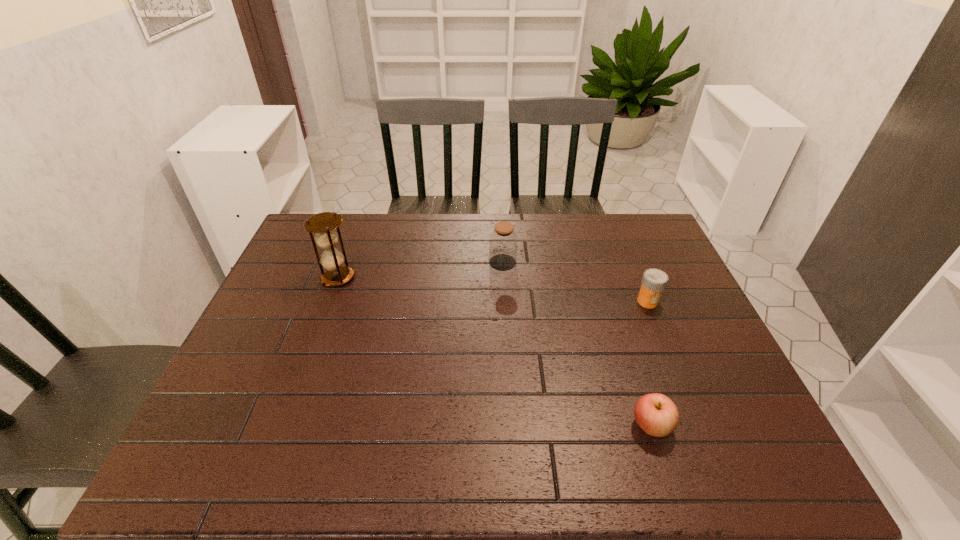
You are a GUI agent. You are given a task and a screenshot of the screen. Output one action in this format:
    pyautogui.click(x=<x>, y=<y>)
    Task: Click on the free point located on the label side of the second nearest object
    
    Given the screenshot: What is the action you would take?
    pyautogui.click(x=667, y=348)

Image resolution: width=960 pixels, height=540 pixels. I want to click on vacant space positioned on the right of the apple, so click(x=704, y=426).

Where is `object that is at the far edge`? object that is at the far edge is located at coordinates (503, 240).

Find the location of a particular element. This screenshot has height=540, width=960. object at the near edge is located at coordinates (656, 414).

Identify the location of object that is at the left edge. The width and height of the screenshot is (960, 540). (323, 224).

I want to click on object that is positioned at the right edge, so click(654, 281).

Image resolution: width=960 pixels, height=540 pixels. I want to click on vacant area at the far edge of the desktop, so click(534, 237).

The image size is (960, 540). I want to click on blank space at the near edge, so tap(517, 450).

Where is `vacant space at the left edge of the desktop`? The height and width of the screenshot is (540, 960). vacant space at the left edge of the desktop is located at coordinates (234, 360).

Identify the location of vacant region at the right edge of the desktop. (654, 259).